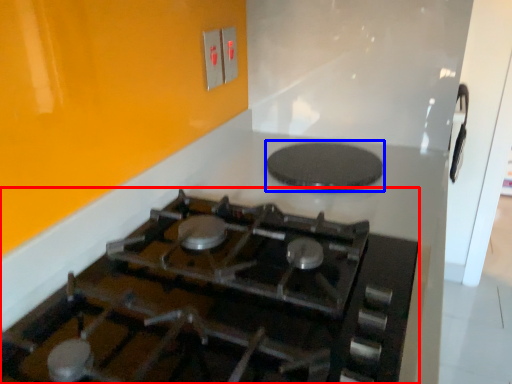
Question: Which object is further to the camera taking this photo, gas stove (highlighted by a red box) or pizza pan (highlighted by a blue box)?

Choices:
 (A) gas stove
 (B) pizza pan

Answer: (B)